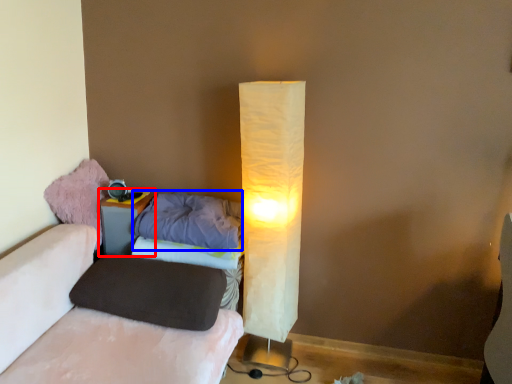
Question: Among these objects, which one is farthest to the camera, nightstand (highlighted by a red box) or pillow (highlighted by a blue box)?

Choices:
 (A) nightstand
 (B) pillow

Answer: (A)